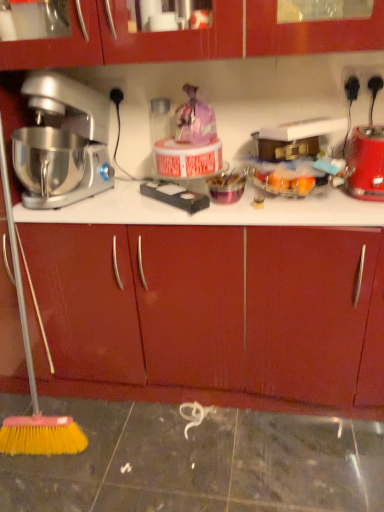
Where is `free space to the right of silver metallic mixer at left`? free space to the right of silver metallic mixer at left is located at coordinates (135, 196).